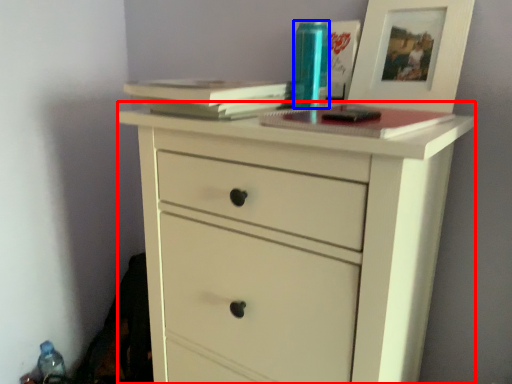
Question: Which of the following is the farthest to the observer, chest of drawers (highlighted by a red box) or bottle (highlighted by a blue box)?

Choices:
 (A) chest of drawers
 (B) bottle

Answer: (B)